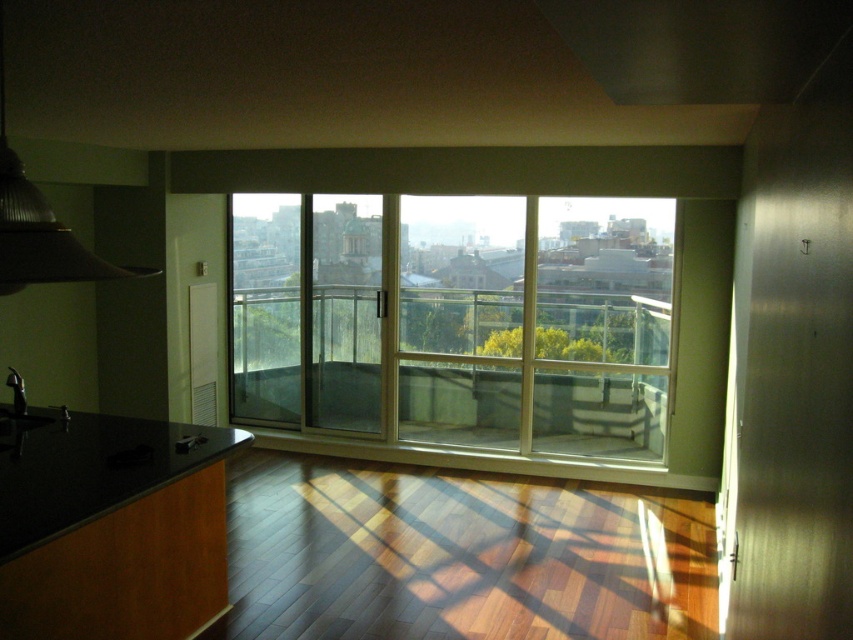
Between point (651, 412) and point (129, 461), which one is positioned behind?

The point (651, 412) is behind.

Does clear glass window at center lie in front of black granite countertop at lower left?

No.

The image size is (853, 640). Identify the location of clear glass window at center. (491, 324).

At what (x,y) coordinates should I click in order to perform the action: click on clear glass window at center. Please return your answer as a coordinate pair (x, y). Looking at the image, I should click on (491, 324).